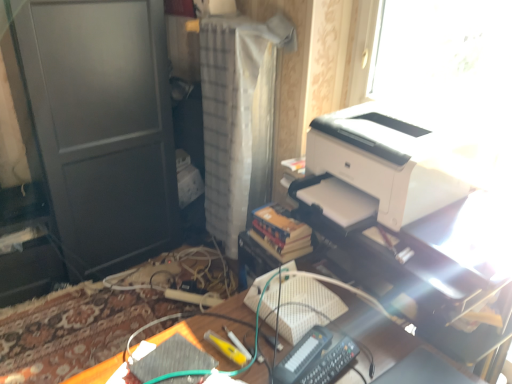
Question: Considering the relative sizes of wooden desk at center and white glossy printer at upper right in the image provided, is wooden desk at center shorter than white glossy printer at upper right?

Choices:
 (A) yes
 (B) no

Answer: (A)

Question: Is white glossy printer at upper right completely or partially inside wooden desk at center?

Choices:
 (A) yes
 (B) no

Answer: (B)

Question: Is wooden desk at center thinner than white glossy printer at upper right?

Choices:
 (A) no
 (B) yes

Answer: (A)

Question: Is wooden desk at center facing towards white glossy printer at upper right?

Choices:
 (A) yes
 (B) no

Answer: (B)

Question: Considering the relative sizes of wooden desk at center and white glossy printer at upper right in the image provided, is wooden desk at center taller than white glossy printer at upper right?

Choices:
 (A) yes
 (B) no

Answer: (B)

Question: Which is correct: wooden desk at center is inside white textured curtain at center, or outside of it?

Choices:
 (A) outside
 (B) inside

Answer: (A)

Question: From a real-world perspective, is wooden desk at center physically located above or below white textured curtain at center?

Choices:
 (A) above
 (B) below

Answer: (B)

Question: In the image, is wooden desk at center positioned in front of or behind white textured curtain at center?

Choices:
 (A) front
 (B) behind

Answer: (A)

Question: In terms of size, does wooden desk at center appear bigger or smaller than white textured curtain at center?

Choices:
 (A) big
 (B) small

Answer: (A)

Question: Choose the correct answer: Is white glossy printer at upper right inside white textured curtain at center or outside it?

Choices:
 (A) inside
 (B) outside

Answer: (B)

Question: Considering the positions of white glossy printer at upper right and white textured curtain at center in the image, is white glossy printer at upper right wider or thinner than white textured curtain at center?

Choices:
 (A) wide
 (B) thin

Answer: (B)

Question: Considering the relative positions of white glossy printer at upper right and white textured curtain at center in the image provided, is white glossy printer at upper right to the left or to the right of white textured curtain at center?

Choices:
 (A) right
 (B) left

Answer: (A)

Question: From a real-world perspective, relative to white textured curtain at center, is white glossy printer at upper right vertically above or below?

Choices:
 (A) below
 (B) above

Answer: (B)

Question: From the image's perspective, relative to white textured curtain at center, is white matte printer at upper right above or below?

Choices:
 (A) above
 (B) below

Answer: (B)

Question: Is point (351, 162) closer or farther from the camera than point (211, 147)?

Choices:
 (A) farther
 (B) closer

Answer: (B)